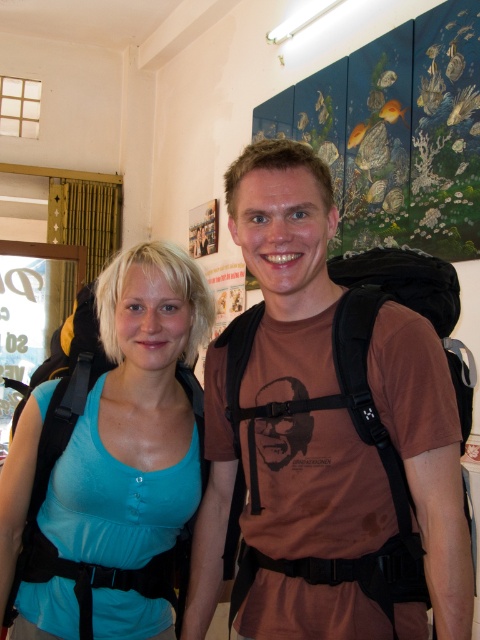
From the picture: Between brown matte t-shirt at center and teal fabric tank top at center, which one appears on the left side from the viewer's perspective?

teal fabric tank top at center is more to the left.

Between point (408, 634) and point (160, 241), which one is positioned in front?

Positioned in front is point (408, 634).

Identify the location of brown matte t-shirt at center. (286, 268).